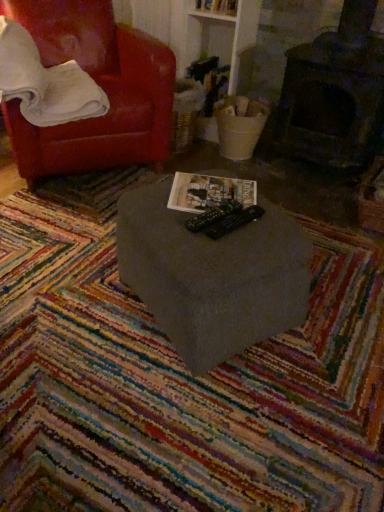
Locate an element on the screen. free spot in front of matte gray table at center is located at coordinates (206, 420).